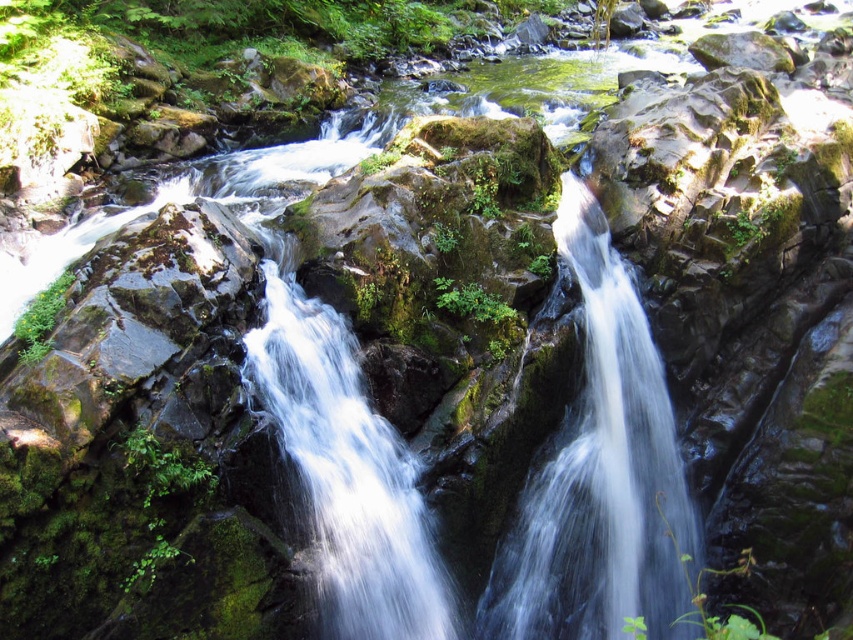
You are a hiker who wants to cross the stream safely. You see the translucent glass waterfall at center and the clear water at center. Which path should you choose to avoid slippery rocks?

The translucent glass waterfall at center is above clear water at center, so the clear water at center is less slippery and safer for crossing.

You are a hiker who wants to cross the stream but needs to avoid the translucent glass waterfall at center. Based on the coordinates provided, can you determine if the waterfall is positioned near the center of the image?

The translucent glass waterfall at center is located at coordinates point (599, 476), which is close to the center of the image, so yes, it is positioned near the center of the image.

You are a hiker who wants to cross the stream safely. You see the translucent glass waterfall at center and the clear water at center. Which one should you avoid stepping on to prevent slipping?

You should avoid stepping on the translucent glass waterfall at center because it is made of glass, which is slippery, while the clear water at center is just water and less slippery.